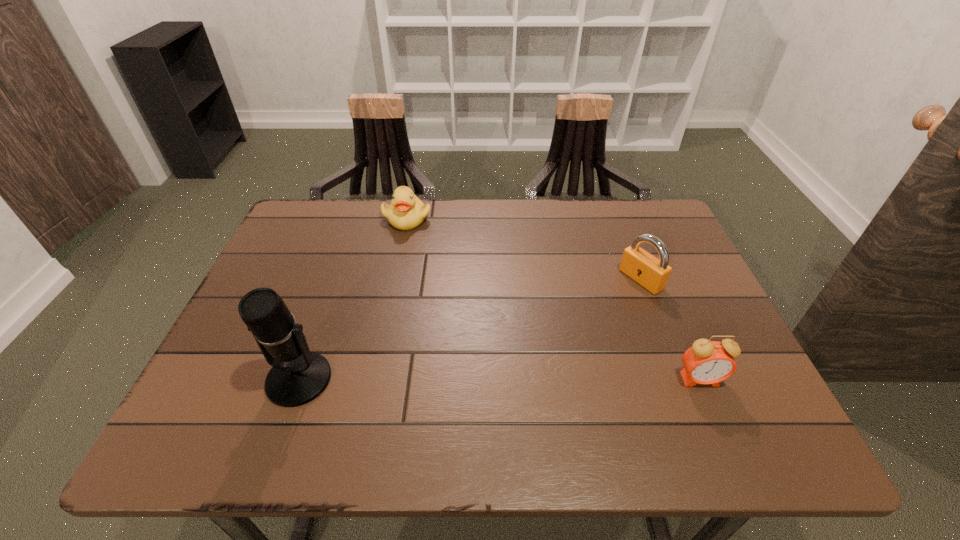
You are a GUI agent. You are given a task and a screenshot of the screen. Output one action in this format:
    pyautogui.click(x=<x>, y=<y>)
    Task: Click on the tallest object
    The width and height of the screenshot is (960, 540).
    Given the screenshot: What is the action you would take?
    pyautogui.click(x=298, y=376)

Find the location of a particular element. the leftmost object is located at coordinates (298, 376).

This screenshot has height=540, width=960. Find the location of `alarm clock`. alarm clock is located at coordinates (707, 362).

Where is `the second farthest object`? The height and width of the screenshot is (540, 960). the second farthest object is located at coordinates (641, 266).

Identify the location of the second object from left to right. (406, 211).

You are a GUI agent. You are given a task and a screenshot of the screen. Output one action in this format:
    pyautogui.click(x=<x>, y=<y>)
    Task: Click on the shortest object
    This screenshot has height=540, width=960.
    Given the screenshot: What is the action you would take?
    pyautogui.click(x=406, y=211)

Where is `vacant position located on the back of the tallest object`? vacant position located on the back of the tallest object is located at coordinates (330, 290).

This screenshot has height=540, width=960. Find the location of `free space located to unlock the second farthest object from the front`. free space located to unlock the second farthest object from the front is located at coordinates (503, 363).

Find the location of `free spot located to unlock the second farthest object from the front`. free spot located to unlock the second farthest object from the front is located at coordinates (539, 342).

This screenshot has height=540, width=960. Identify the location of vacant space located to unlock the second farthest object from the front. (545, 339).